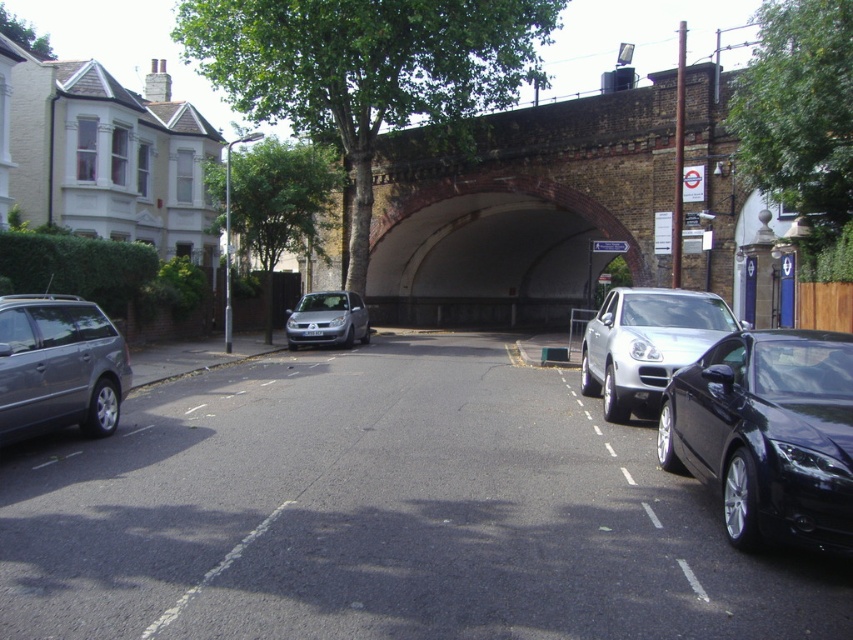
Who is higher up, satin silver suv at center or satin silver car at center?

satin silver suv at center is above.

Is satin silver suv at center below satin silver car at center?

Actually, satin silver suv at center is above satin silver car at center.

Which is in front, point (639, 339) or point (340, 301)?

Positioned in front is point (639, 339).

Image resolution: width=853 pixels, height=640 pixels. Identify the location of satin silver suv at center. (646, 344).

Does brick tunnel at center appear on the right side of satin silver car at center?

Yes, brick tunnel at center is to the right of satin silver car at center.

Between point (494, 115) and point (329, 291), which one is positioned in front?

Positioned in front is point (494, 115).

You are a GUI agent. You are given a task and a screenshot of the screen. Output one action in this format:
    pyautogui.click(x=<x>, y=<y>)
    Task: Click on the brick tunnel at center
    This screenshot has height=640, width=853.
    Given the screenshot: What is the action you would take?
    pyautogui.click(x=520, y=209)

Between brick tunnel at center and matte gray station wagon at left, which one appears on the left side from the viewer's perspective?

matte gray station wagon at left

Measure the distance from brick tunnel at center to matte gray station wagon at left.

They are 76.71 feet apart.

Which is behind, point (515, 212) or point (109, 381)?

The point (515, 212) is behind.

The height and width of the screenshot is (640, 853). I want to click on brick tunnel at center, so 520,209.